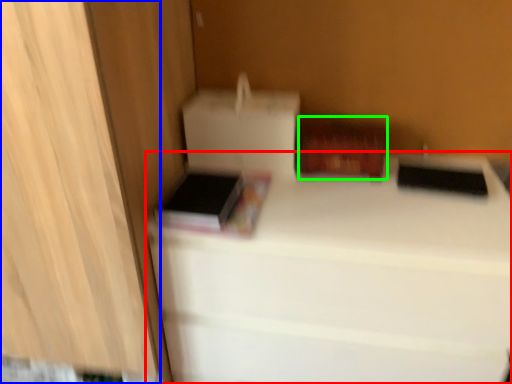
Question: Which object is positioned farthest from furniture (highlighted by a red box)? Select from cabinetry (highlighted by a blue box) and cardboard box (highlighted by a green box).

Choices:
 (A) cabinetry
 (B) cardboard box

Answer: (A)